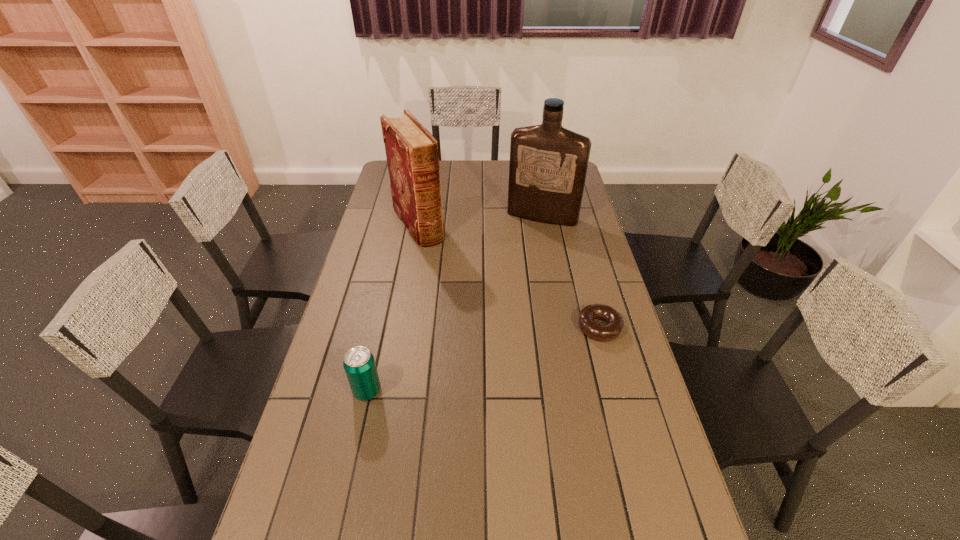
Where is `free spot on the desktop that is between the third tallest object and the doughnut and is positioned on the label side of the liquor`? free spot on the desktop that is between the third tallest object and the doughnut and is positioned on the label side of the liquor is located at coordinates (486, 359).

Locate an element on the screen. The image size is (960, 540). free spot on the desktop that is between the third tallest object and the doughnut and is positioned on the spine side of the second tallest object is located at coordinates (508, 353).